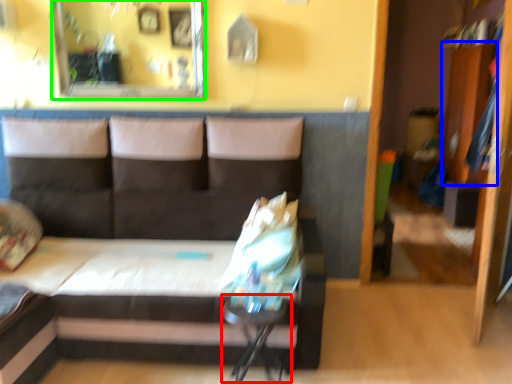
Question: Estimate the real-world distances between objects in this image. Which object is farther from table (highlighted by a red box), dresser (highlighted by a blue box) or mirror (highlighted by a green box)?

Choices:
 (A) dresser
 (B) mirror

Answer: (A)